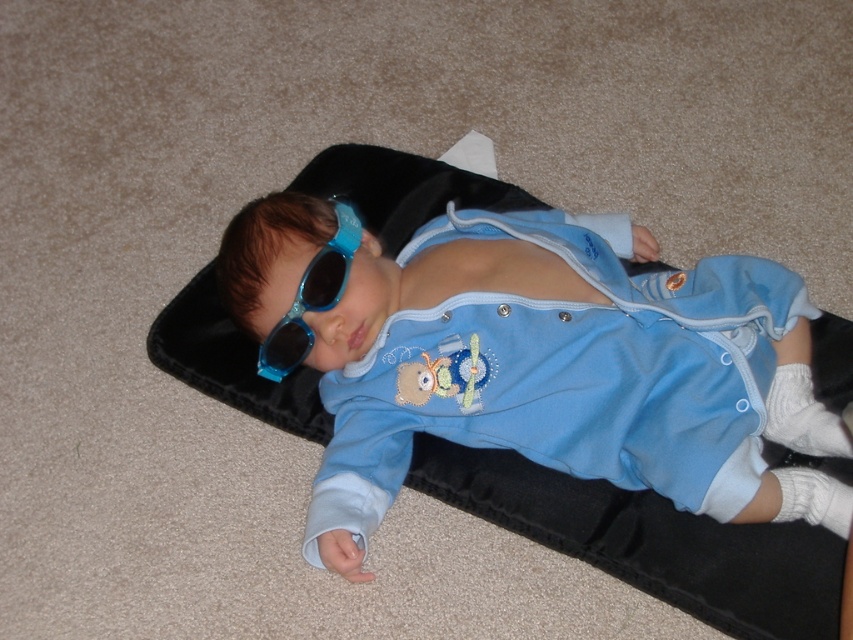
Can you confirm if blue fabric stomach at center is smaller than blue shiny sunglasses at center?

Correct, blue fabric stomach at center occupies less space than blue shiny sunglasses at center.

Is blue fabric stomach at center taller than blue shiny sunglasses at center?

Incorrect, blue fabric stomach at center's height is not larger of blue shiny sunglasses at center's.

Between point (438, 298) and point (329, 237), which one is positioned behind?

The point (438, 298) is more distant.

Locate an element on the screen. Image resolution: width=853 pixels, height=640 pixels. blue fabric stomach at center is located at coordinates (489, 273).

Image resolution: width=853 pixels, height=640 pixels. Identify the location of blue soft fabric baby at center. (532, 358).

Locate an element on the screen. blue soft fabric baby at center is located at coordinates (532, 358).

Is blue soft fabric baby at center shorter than blue shiny sunglasses at center?

In fact, blue soft fabric baby at center may be taller than blue shiny sunglasses at center.

Is blue soft fabric baby at center to the right of blue shiny sunglasses at center from the viewer's perspective?

Yes, blue soft fabric baby at center is to the right of blue shiny sunglasses at center.

Between point (733, 522) and point (339, 275), which one is positioned behind?

The point (339, 275) is more distant.

This screenshot has height=640, width=853. I want to click on blue soft fabric baby at center, so click(x=532, y=358).